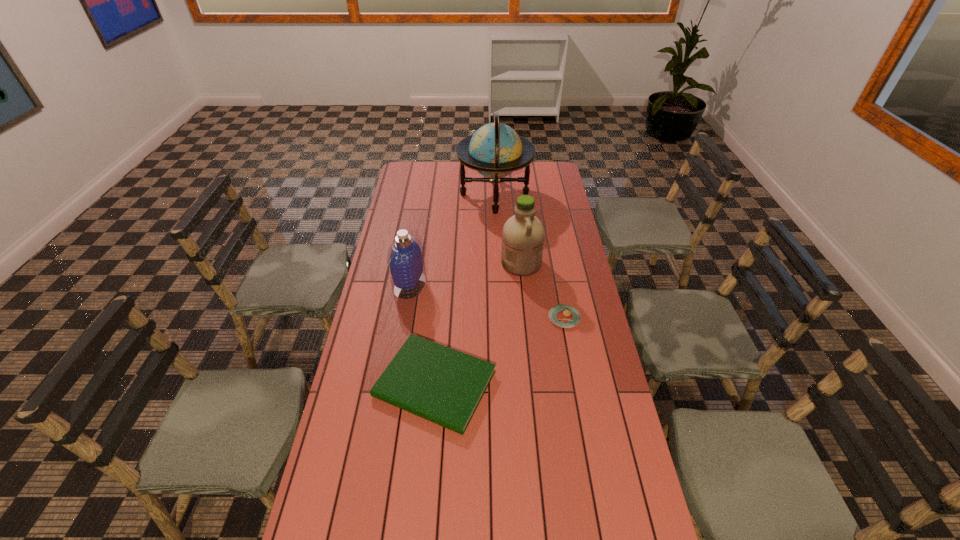
You are a GUI agent. You are given a task and a screenshot of the screen. Output one action in this format:
    pyautogui.click(x=<x>, y=<y>)
    Task: Click on the object present at the right edge
    The height and width of the screenshot is (540, 960).
    Given the screenshot: What is the action you would take?
    pyautogui.click(x=566, y=316)

Where is `vacant space at the far edge of the desktop`? The image size is (960, 540). vacant space at the far edge of the desktop is located at coordinates (516, 182).

Find the location of a particular element. This screenshot has height=540, width=960. free spot at the left edge of the desktop is located at coordinates (369, 293).

At what (x,y) coordinates should I click in order to perform the action: click on vacant space at the right edge of the desktop. Please return your answer as a coordinate pair (x, y). Looking at the image, I should click on (597, 362).

In the image, there is a desktop. Where is `vacant space at the far right corner`? vacant space at the far right corner is located at coordinates (535, 183).

Find the location of a particular element. The height and width of the screenshot is (540, 960). free space between the third shortest object and the second nearest object is located at coordinates (487, 301).

The width and height of the screenshot is (960, 540). What are the coordinates of `blank region between the paperback book and the left cleansing agent` in the screenshot? It's located at (422, 334).

Locate an element on the screen. Image resolution: width=960 pixels, height=540 pixels. free spot between the paperback book and the fourth shortest object is located at coordinates (478, 323).

In order to click on unoccupied position between the pastry and the fourth shortest object in this screenshot , I will do `click(542, 291)`.

You are a GUI agent. You are given a task and a screenshot of the screen. Output one action in this format:
    pyautogui.click(x=<x>, y=<y>)
    Task: Click on the object that can be found as the closest to the third tallest object
    
    Given the screenshot: What is the action you would take?
    pyautogui.click(x=445, y=386)